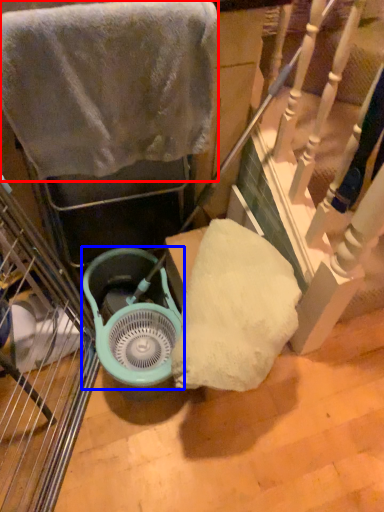
Question: Among these objects, which one is nearest to the camera, towel (highlighted by a red box) or fan (highlighted by a blue box)?

Choices:
 (A) towel
 (B) fan

Answer: (A)